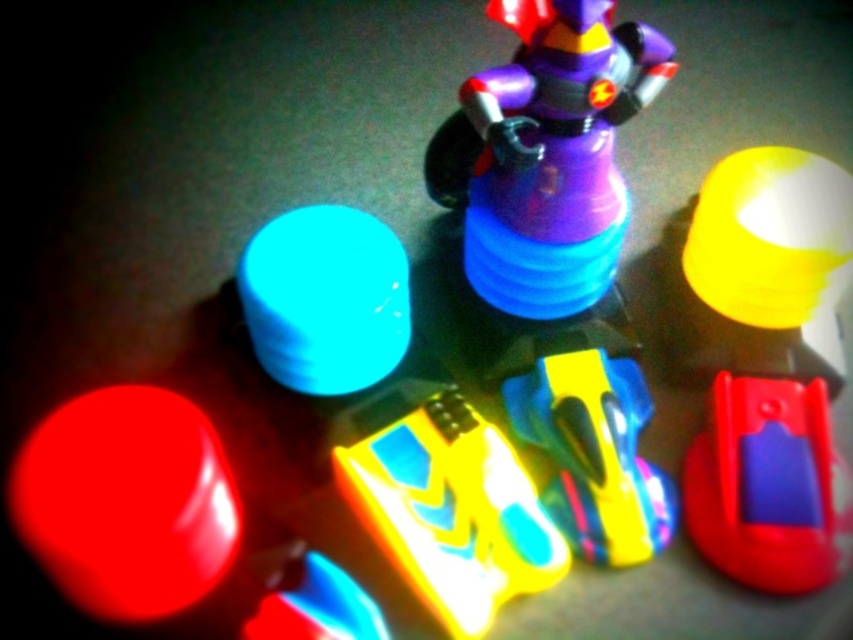
You are a child trying to find the purple matte figure at center and the matte plastic cup at upper left. If you look from the cup, which direction should you turn to face the figure?

The purple matte figure at center is to the right of the matte plastic cup at upper left, so you should turn to your right to face the figure.

You are a character in the image and you want to reach the matte plastic cup at upper left. Which direction should you move from your current position at the center of the image?

The matte plastic cup at upper left is located at coordinates 0.469 on the x axis and 0.382 on the y axis. Since you are at the center, which is at 0.5 on both axes, you should move slightly to the left and down to reach it.